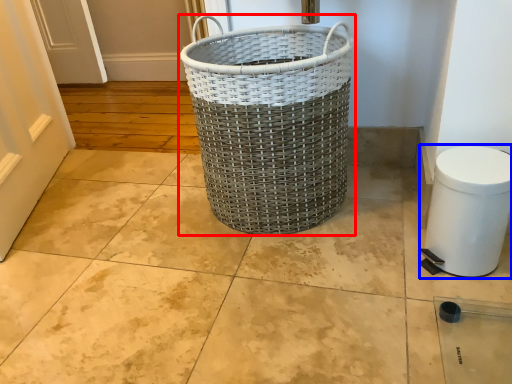
Question: Which of the following is the closest to the observer, waste container (highlighted by a red box) or gray (highlighted by a blue box)?

Choices:
 (A) waste container
 (B) gray

Answer: (B)